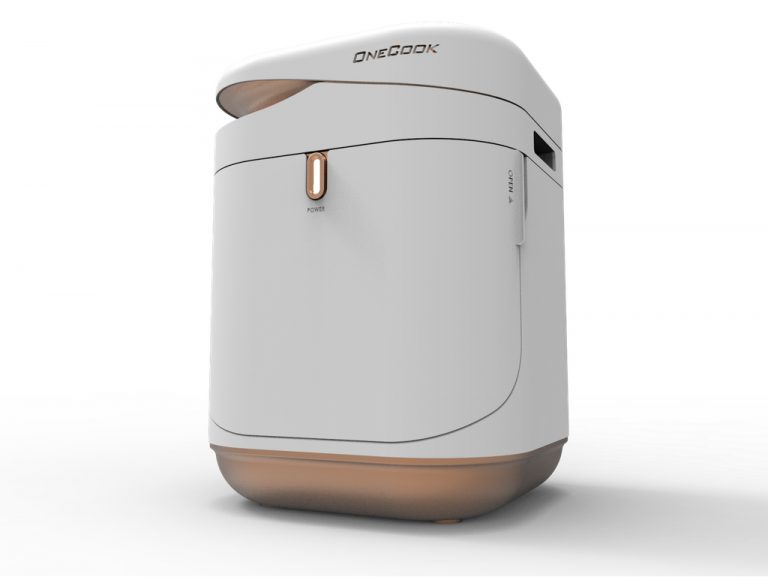
Where is `handle`? This screenshot has width=768, height=577. handle is located at coordinates (310, 170).